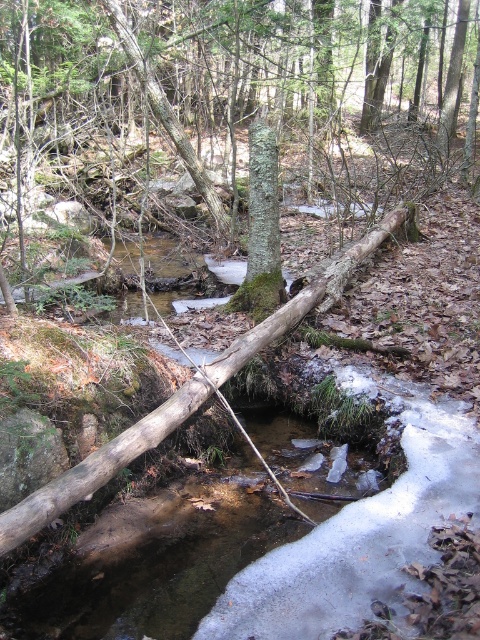
You are a hiker trying to determine the best path through the forest. You notice two green rough bark trees in the center of the image. Which one is wider? The options are the green rough bark tree at center and the green rough bark tree trunk at center.

The green rough bark tree at center is wider than the green rough bark tree trunk at center.

You are a hiker trying to cross the stream in the forest. You see the green rough bark tree at center and the clear water at center. Which object is taller and can help you judge the depth of the stream?

The green rough bark tree at center is taller than the clear water at center, so it can help you judge the depth of the stream as it provides a reference point for height.

You are standing at the origin point in the forest scene. Where is the green rough bark tree at center located in terms of coordinates?

The green rough bark tree at center is located at coordinates point (241, 81).